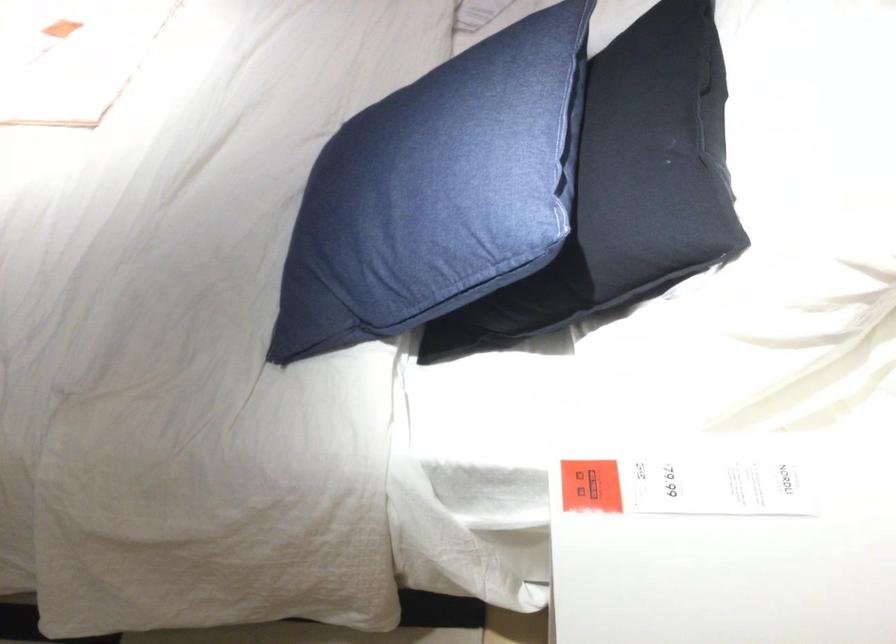
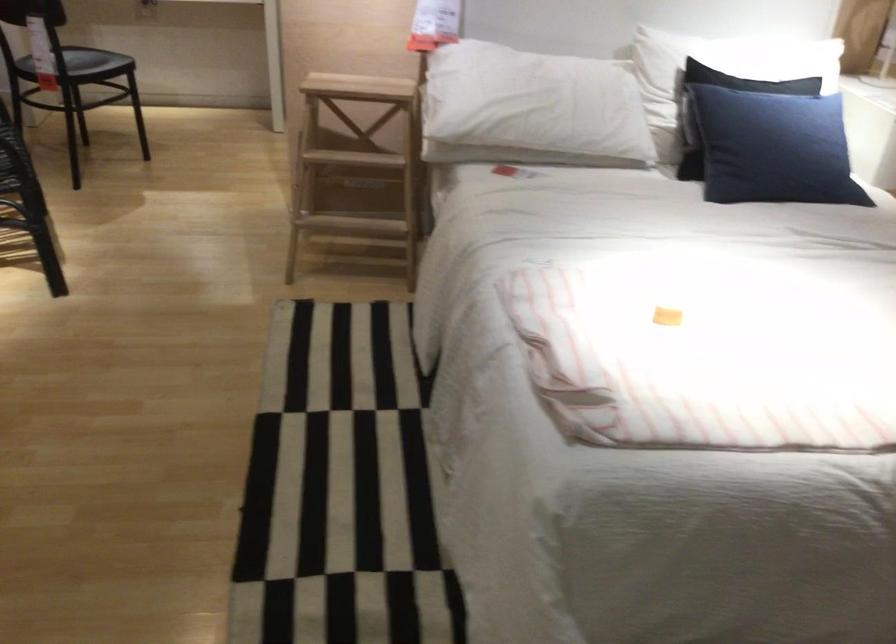
Find the pixel in the second image that matches [371,143] in the first image.

(773, 147)